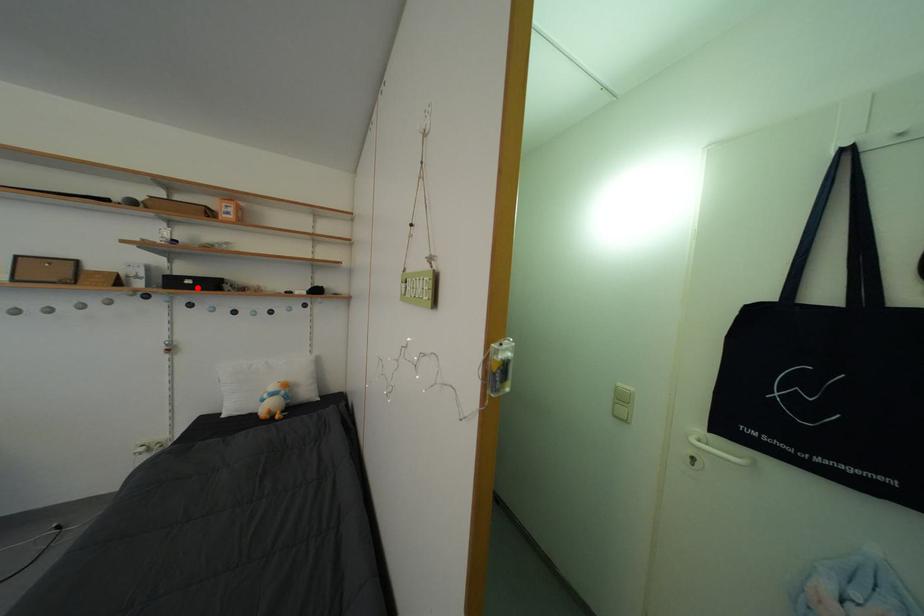
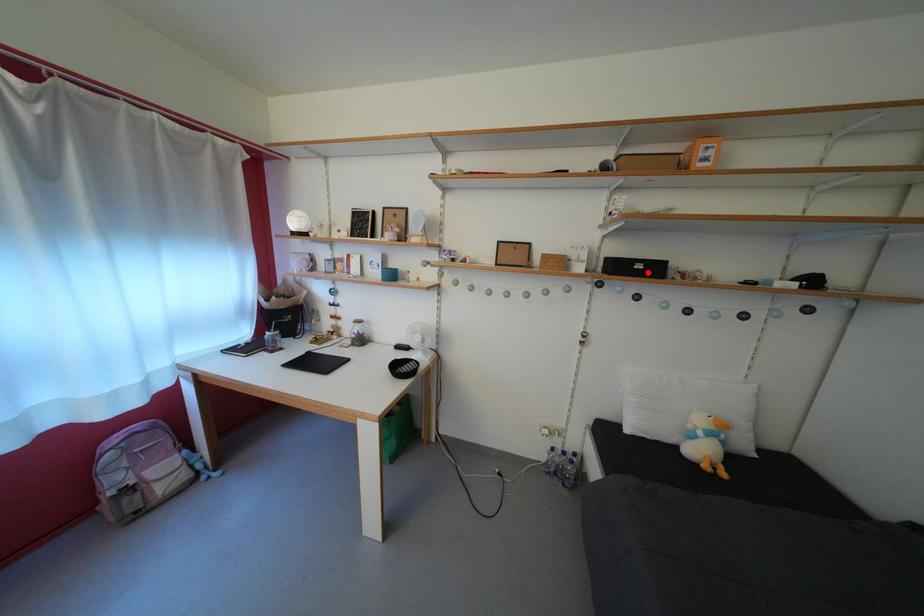
I am providing you with two images of the same scene from different viewpoints. A red point is marked on the first image and another point is marked on the second image. Is the red point in image1 aligned with the point shown in image2?

Yes